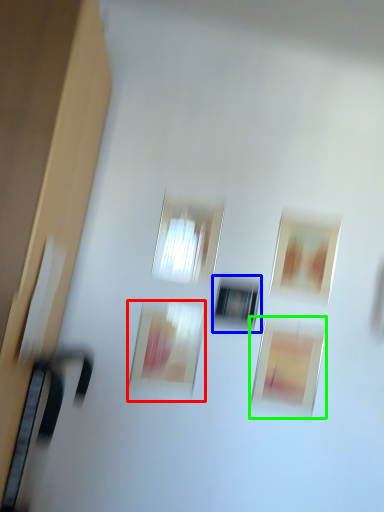
Question: Considering the real-world distances, which object is closest to picture frame (highlighted by a red box)? window (highlighted by a blue box) or picture frame (highlighted by a green box).

Choices:
 (A) window
 (B) picture frame

Answer: (A)